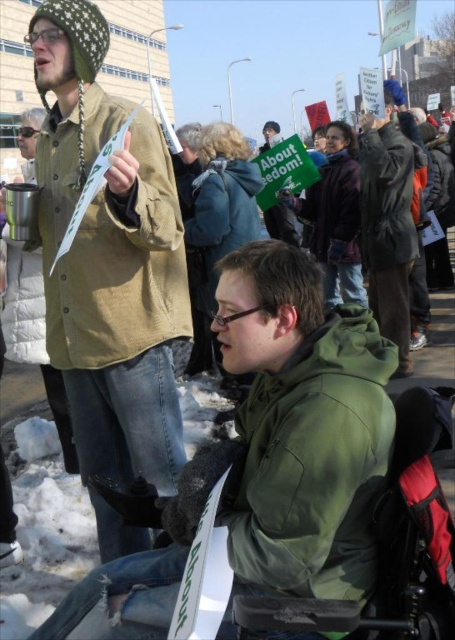
You are a photographer trying to capture a photo of the matte brown jacket at upper left and the green quilted jacket at upper left. Which jacket should you focus on first if you want to include both in your frame without moving the camera?

The matte brown jacket at upper left is below the green quilted jacket at upper left, so you should focus on the green quilted jacket at upper left first to ensure both are in the frame.

You are a photographer trying to capture a candid shot of the matte brown jacket at upper left and the green quilted jacket at upper left. The camera you are using has a lens that can focus on objects within a 20 inch range. Can you fit both jackets into the focus range of your camera?

The matte brown jacket at upper left is 25.31 inches away from the green quilted jacket at upper left. Since the distance between them exceeds the 20 inch focus range of the camera, you cannot fit both jackets into the focus range.